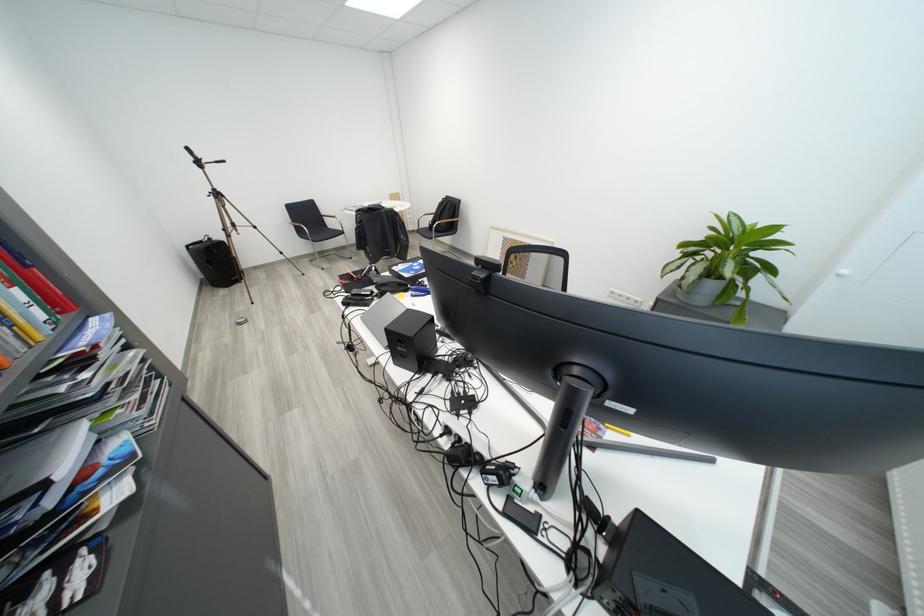
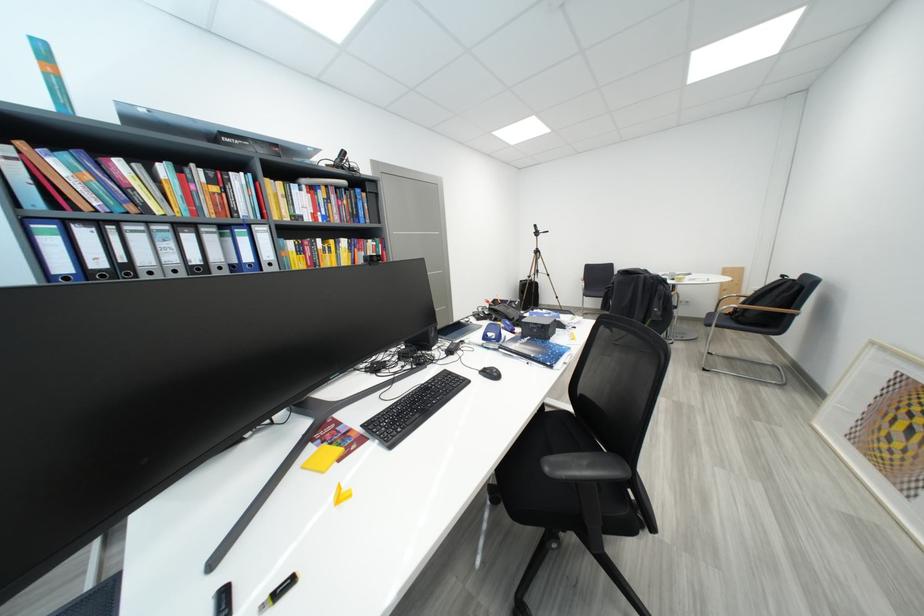
Locate, in the second image, the point that corresponds to pixel 501 230 in the first image.

(881, 346)